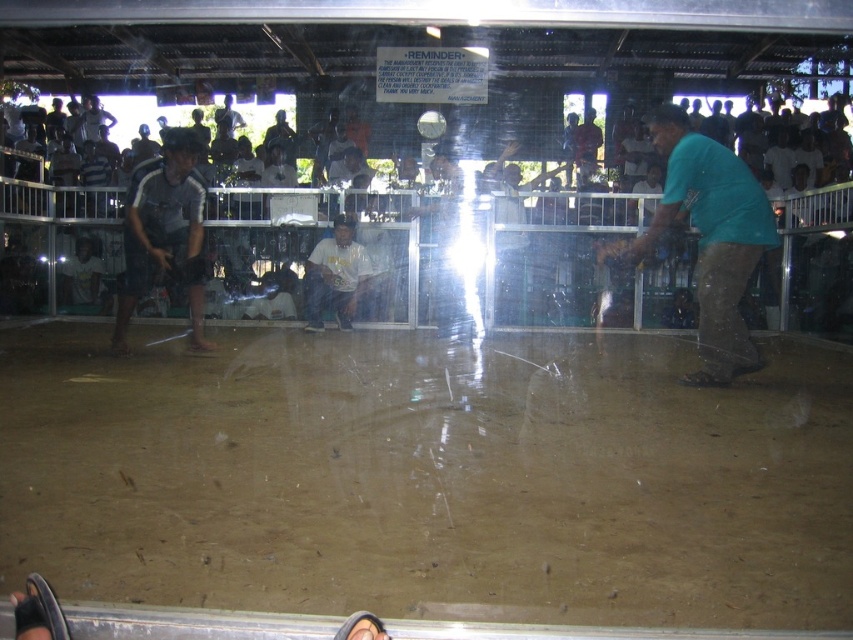
Looking at this image, you are a spectator watching the game in the arena. You want to locate the white matte shirt at center. Where exactly is it positioned in the arena?

The white matte shirt at center is positioned at point 0.431 on the x axis and 0.394 on the y axis.